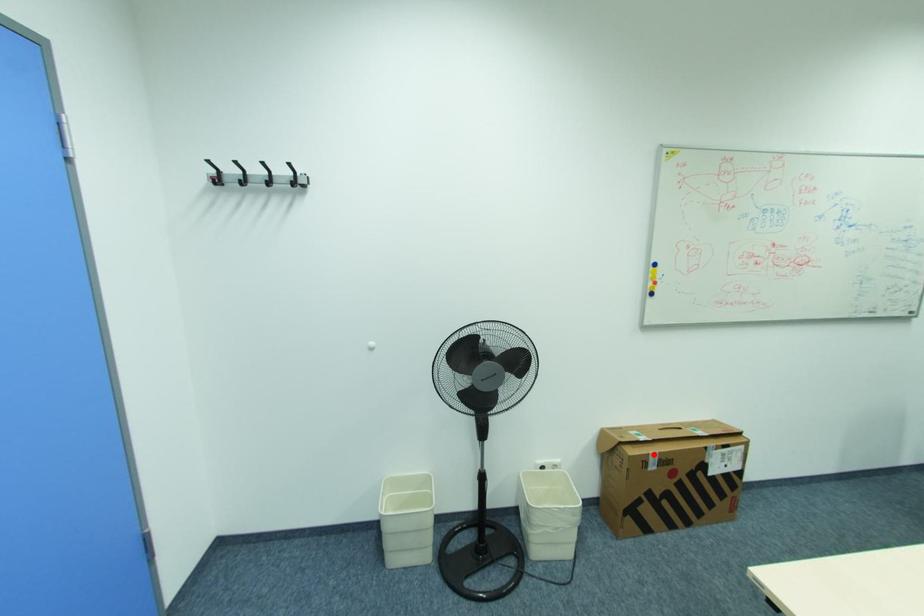
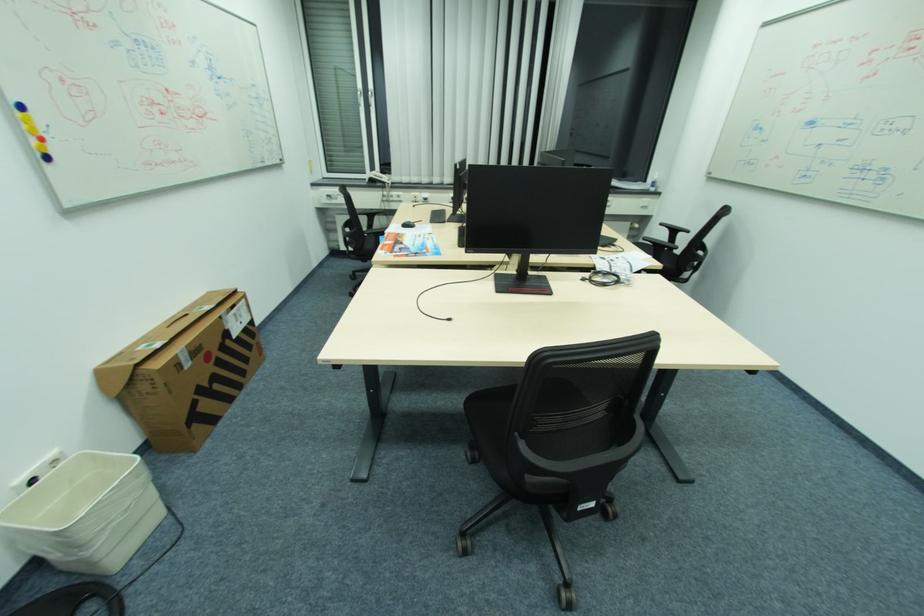
Question: I am providing you with two images of the same scene from different viewpoints. In image1, a red point is highlighted. Considering the same 3D point in image2, which of the following is correct?

Choices:
 (A) It is closer
 (B) It is farther

Answer: (A)